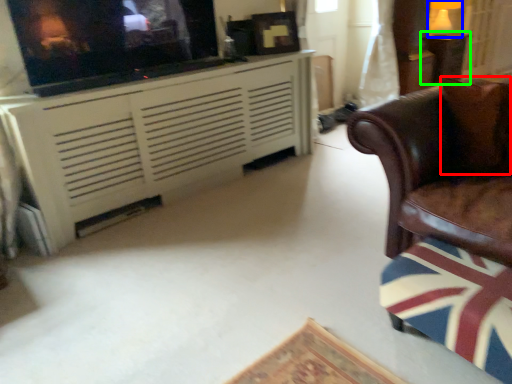
Question: Which object is the farthest from pillow (highlighted by a red box)? Choose among these: lamp (highlighted by a blue box) or table (highlighted by a green box).

Choices:
 (A) lamp
 (B) table

Answer: (A)